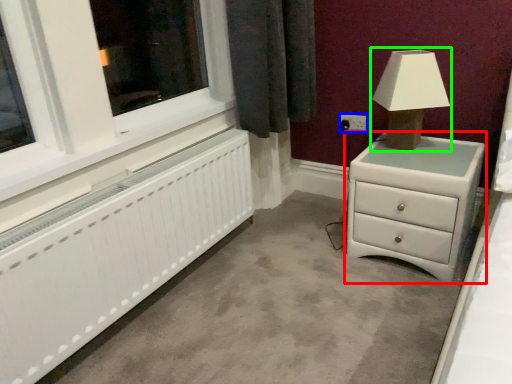
Question: Considering the real-world distances, which object is closest to chest of drawers (highlighted by a red box)? electric outlet (highlighted by a blue box) or table lamp (highlighted by a green box).

Choices:
 (A) electric outlet
 (B) table lamp

Answer: (B)